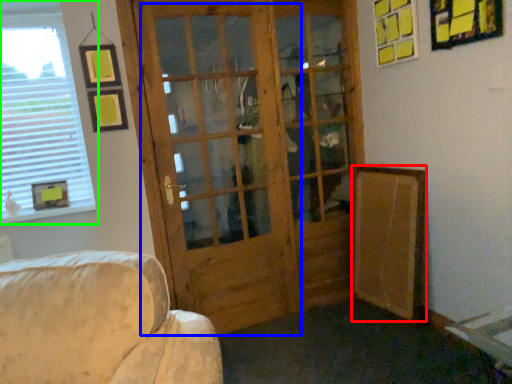
Question: Estimate the real-world distances between objects in this image. Which object is farther from bulletin board (highlighted by a red box), screen door (highlighted by a blue box) or window (highlighted by a green box)?

Choices:
 (A) screen door
 (B) window

Answer: (B)